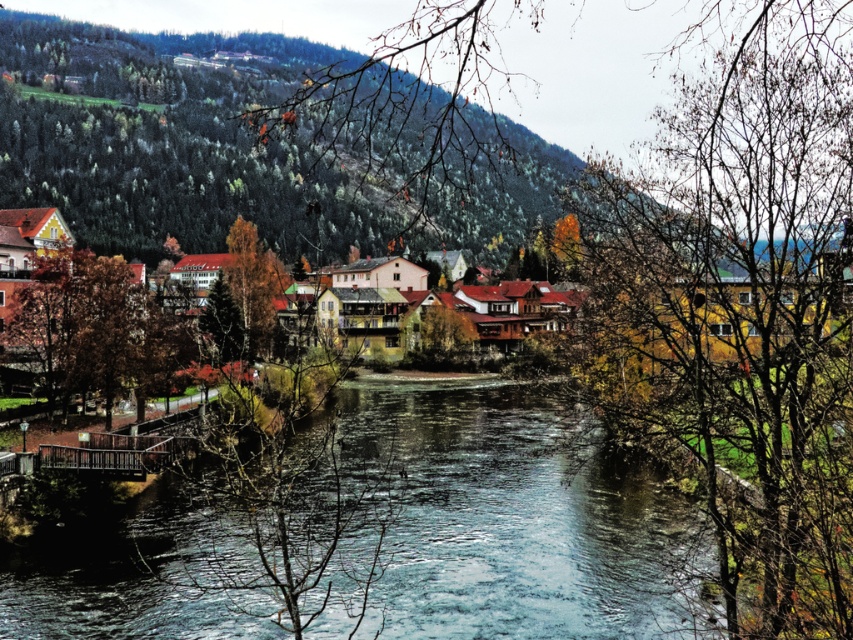
Question: Which of these objects is positioned closest to the clear water stream at center?

Choices:
 (A) bare branches at center
 (B) golden yellow leaves at center

Answer: (B)

Question: In this image, where is clear water stream at center located relative to golden yellow leaves at center?

Choices:
 (A) below
 (B) above

Answer: (A)

Question: Can you confirm if bare branches at center is positioned to the left of golden yellow leaves at center?

Choices:
 (A) no
 (B) yes

Answer: (A)

Question: Can you confirm if bare branches at center is positioned to the right of clear water stream at center?

Choices:
 (A) no
 (B) yes

Answer: (B)

Question: Which object is positioned farthest from the bare branches at center?

Choices:
 (A) golden yellow leaves at center
 (B) clear water stream at center

Answer: (A)

Question: Which point appears farthest from the camera in this image?

Choices:
 (A) (344, 545)
 (B) (248, 241)

Answer: (B)